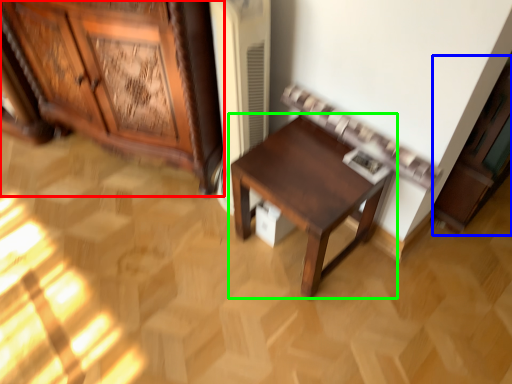
Question: Considering the real-world distances, which object is closest to cabinetry (highlighted by a red box)? cabinetry (highlighted by a blue box) or table (highlighted by a green box).

Choices:
 (A) cabinetry
 (B) table

Answer: (B)